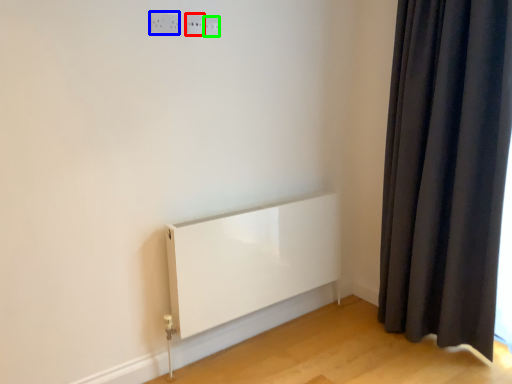
Question: Which is nearer to the electric outlet (highlighted by a red box)? electric outlet (highlighted by a blue box) or electric outlet (highlighted by a green box).

Choices:
 (A) electric outlet
 (B) electric outlet

Answer: (B)